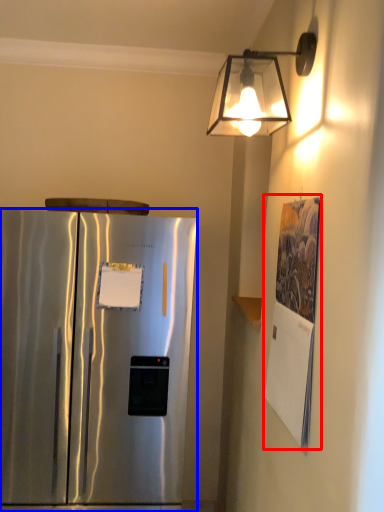
Question: Which of the following is the farthest to the observer, poster (highlighted by a red box) or refrigerator (highlighted by a blue box)?

Choices:
 (A) poster
 (B) refrigerator

Answer: (B)